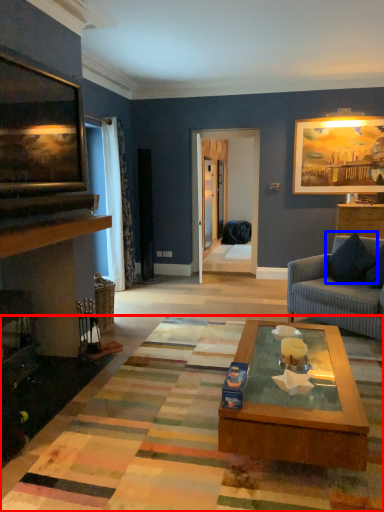
Question: Among these objects, which one is nearest to the camera, mat (highlighted by a red box) or pillow (highlighted by a blue box)?

Choices:
 (A) mat
 (B) pillow

Answer: (A)